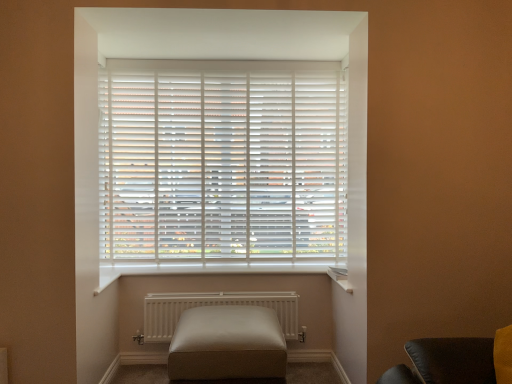
Question: Considering the relative sizes of leather ottoman at center and white matte blinds at center in the image provided, is leather ottoman at center wider than white matte blinds at center?

Choices:
 (A) yes
 (B) no

Answer: (A)

Question: Could you tell me if leather ottoman at center is facing white matte blinds at center?

Choices:
 (A) yes
 (B) no

Answer: (B)

Question: Would you say leather ottoman at center is a long distance from white matte blinds at center?

Choices:
 (A) yes
 (B) no

Answer: (B)

Question: From a real-world perspective, is leather ottoman at center physically below white matte blinds at center?

Choices:
 (A) no
 (B) yes

Answer: (B)

Question: Does leather ottoman at center have a larger size compared to white matte blinds at center?

Choices:
 (A) no
 (B) yes

Answer: (B)

Question: Based on their sizes in the image, would you say leather ottoman at center is bigger or smaller than white matte radiator at center?

Choices:
 (A) big
 (B) small

Answer: (A)

Question: Is leather ottoman at center taller or shorter than white matte radiator at center?

Choices:
 (A) short
 (B) tall

Answer: (B)

Question: Visually, is leather ottoman at center positioned to the left or to the right of white matte radiator at center?

Choices:
 (A) left
 (B) right

Answer: (B)

Question: Looking at their shapes, would you say leather ottoman at center is wider or thinner than white matte radiator at center?

Choices:
 (A) wide
 (B) thin

Answer: (A)

Question: In the image, is white matte blinds at center positioned in front of or behind leather ottoman at center?

Choices:
 (A) front
 (B) behind

Answer: (B)

Question: Is white matte blinds at center wider or thinner than leather ottoman at center?

Choices:
 (A) wide
 (B) thin

Answer: (B)

Question: Based on their positions, is white matte blinds at center located to the left or right of leather ottoman at center?

Choices:
 (A) right
 (B) left

Answer: (B)

Question: In terms of size, does white matte blinds at center appear bigger or smaller than leather ottoman at center?

Choices:
 (A) big
 (B) small

Answer: (B)

Question: Visually, is white matte radiator at center positioned to the left or to the right of white matte blinds at center?

Choices:
 (A) left
 (B) right

Answer: (B)

Question: From their relative heights in the image, would you say white matte radiator at center is taller or shorter than white matte blinds at center?

Choices:
 (A) short
 (B) tall

Answer: (A)